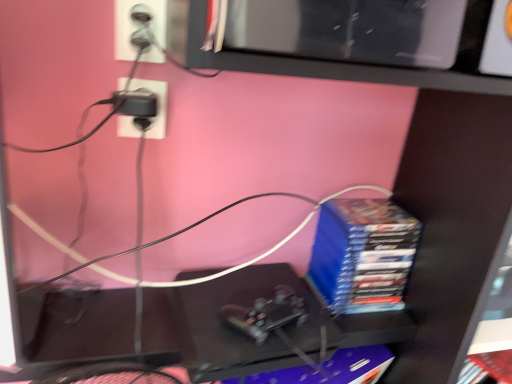
Question: In terms of size, does purple matte paperback book at center, which is the second paperback book from top to bottom, appear bigger or smaller than blue matte stack of books at right, the second paperback book positioned from the bottom?

Choices:
 (A) big
 (B) small

Answer: (B)

Question: In terms of height, does purple matte paperback book at center, which is the second paperback book from top to bottom, look taller or shorter compared to blue matte stack of books at right, which ranks as the 1th paperback book in top-to-bottom order?

Choices:
 (A) tall
 (B) short

Answer: (B)

Question: Considering the relative positions of purple matte paperback book at center, which is the second paperback book from top to bottom, and blue matte stack of books at right, the second paperback book positioned from the bottom, in the image provided, is purple matte paperback book at center, which is the second paperback book from top to bottom, to the left or to the right of blue matte stack of books at right, the second paperback book positioned from the bottom,?

Choices:
 (A) left
 (B) right

Answer: (A)

Question: Considering their positions, is blue matte stack of books at right, which ranks as the 1th paperback book in top-to-bottom order, located in front of or behind purple matte paperback book at center, which is the second paperback book from top to bottom?

Choices:
 (A) front
 (B) behind

Answer: (B)

Question: From the image's perspective, is blue matte stack of books at right, the second paperback book positioned from the bottom, located above or below purple matte paperback book at center, which is the second paperback book from top to bottom?

Choices:
 (A) below
 (B) above

Answer: (B)

Question: From a real-world perspective, relative to purple matte paperback book at center, the 1th paperback book when ordered from bottom to top, is blue matte stack of books at right, which ranks as the 1th paperback book in top-to-bottom order, vertically above or below?

Choices:
 (A) below
 (B) above

Answer: (B)

Question: Is blue matte stack of books at right, the second paperback book positioned from the bottom, inside the boundaries of purple matte paperback book at center, the 1th paperback book when ordered from bottom to top, or outside?

Choices:
 (A) outside
 (B) inside

Answer: (A)